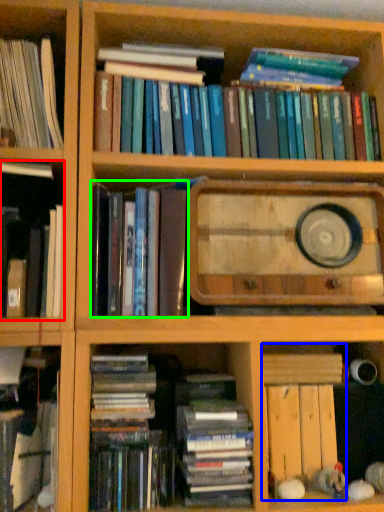
Question: Which object is positioned closest to book (highlighted by a red box)? Select from book (highlighted by a blue box) and book (highlighted by a green box).

Choices:
 (A) book
 (B) book

Answer: (B)